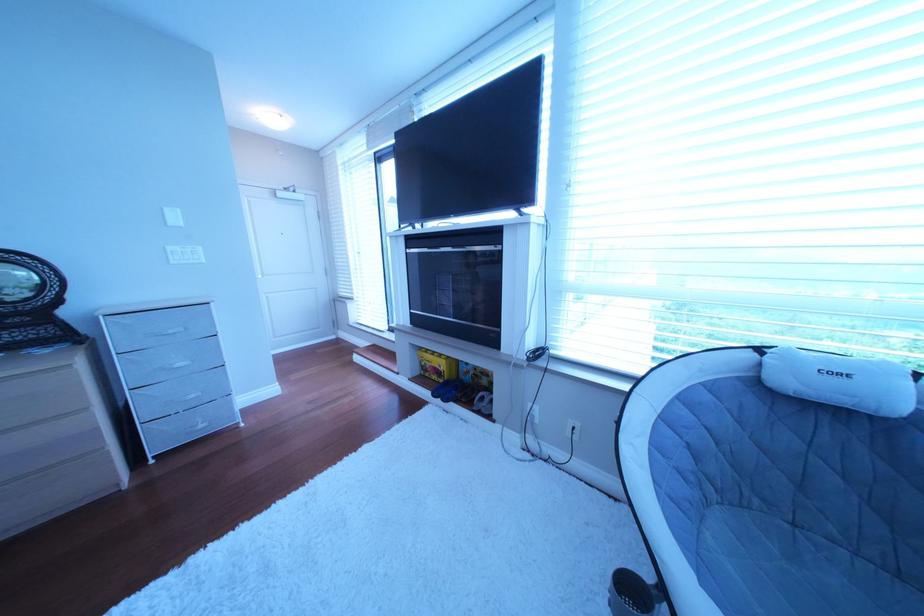
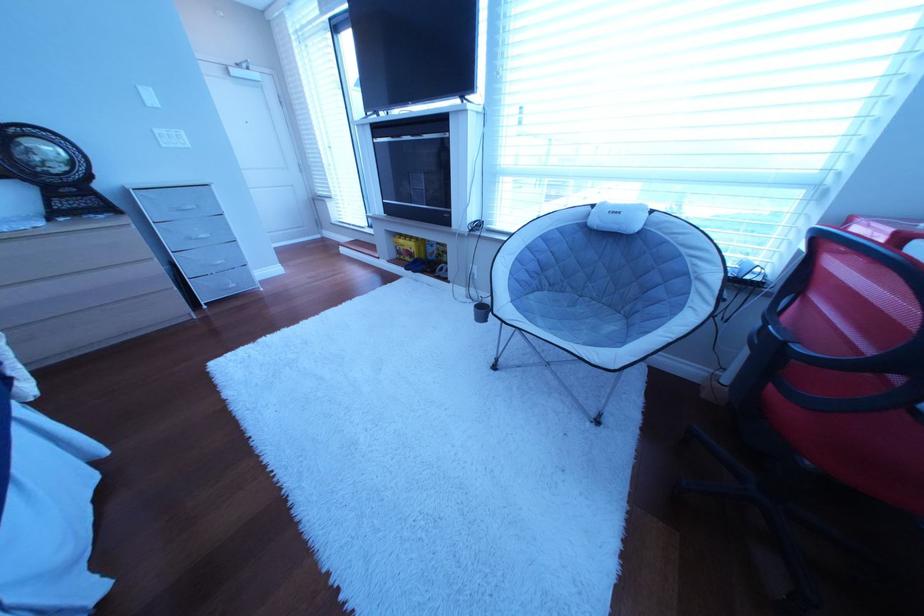
Locate, in the second image, the point that corresponds to point (735, 506) in the first image.

(565, 293)